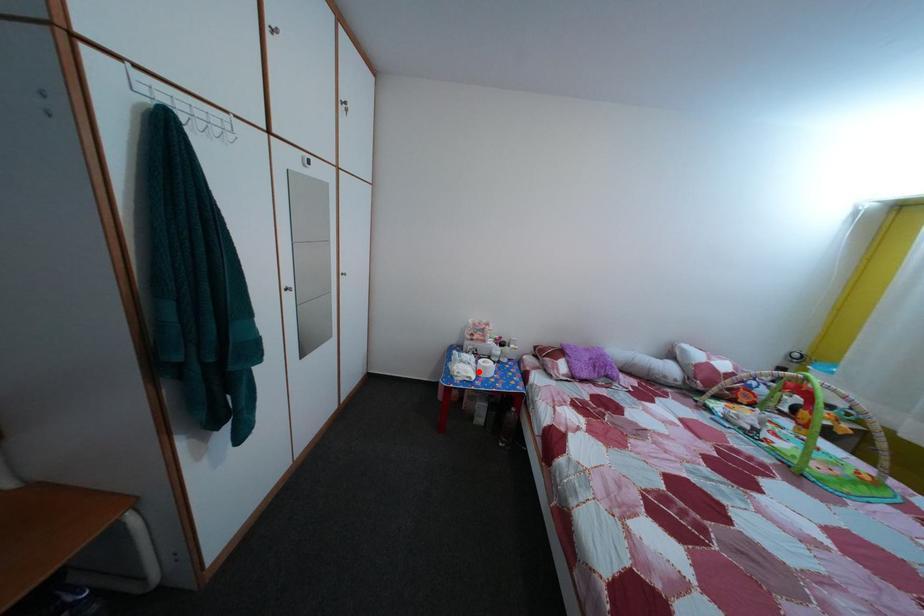
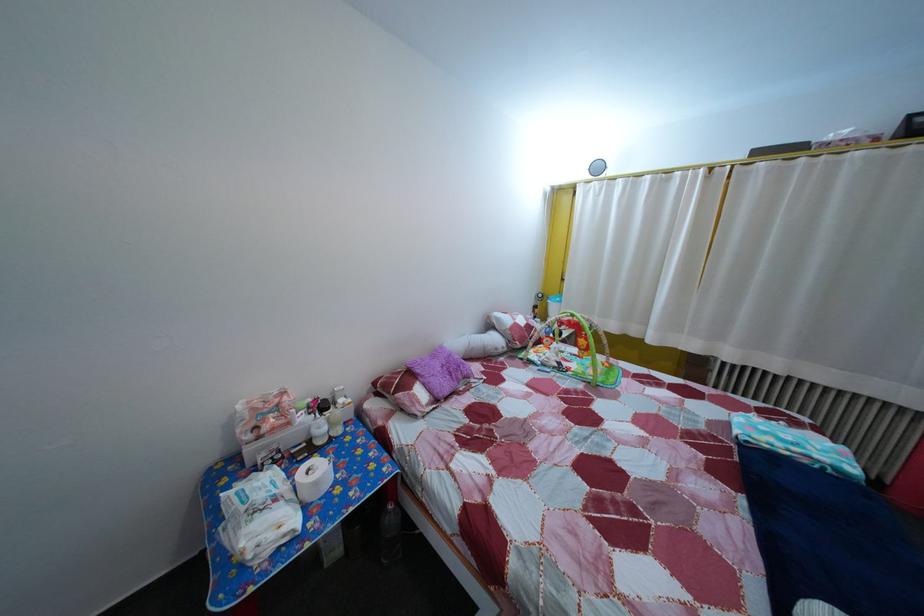
Where in the second image is the point corresponding to the highlighted location from the first image?

(285, 508)